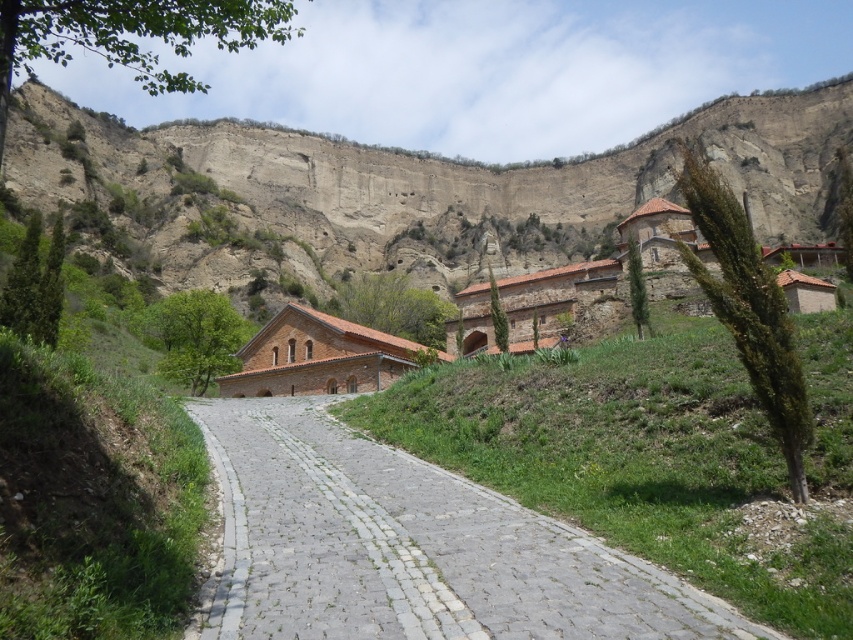
Question: Among these objects, which one is nearest to the camera?

Choices:
 (A) rustic stone cliff at upper center
 (B) gray cobblestone path at center

Answer: (B)

Question: Can you confirm if rustic stone cliff at upper center is positioned above gray cobblestone path at center?

Choices:
 (A) no
 (B) yes

Answer: (B)

Question: Which point is closer to the camera?

Choices:
 (A) rustic stone cliff at upper center
 (B) gray cobblestone path at center

Answer: (B)

Question: Which point appears closest to the camera in this image?

Choices:
 (A) (316, 410)
 (B) (200, 154)

Answer: (A)

Question: Is rustic stone cliff at upper center closer to camera compared to gray cobblestone path at center?

Choices:
 (A) yes
 (B) no

Answer: (B)

Question: Can you confirm if rustic stone cliff at upper center is bigger than gray cobblestone path at center?

Choices:
 (A) no
 (B) yes

Answer: (B)